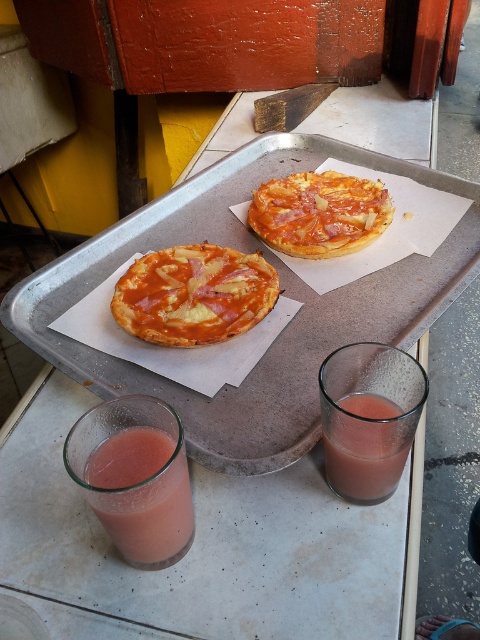
You are a delivery person who just arrived at the location. You see a tray on the table with two small pizzas and two glasses of pinkish red drinks. There is a point marked at coordinate [204,547]. What object is located at that coordinate?

The point at coordinate [204,547] corresponds to the transparent glass at center.

Consider the image. You are a delivery person holding a large box that is 50 centimeters wide. You need to place it on the table without knocking over the silver metallic tray at center. Is there enough space between you and the tray to safely set down the box?

The silver metallic tray at center is 52.98 centimeters away from the viewer. Since the box is 50 centimeters wide, there is sufficient space to safely place the box without disturbing the tray.